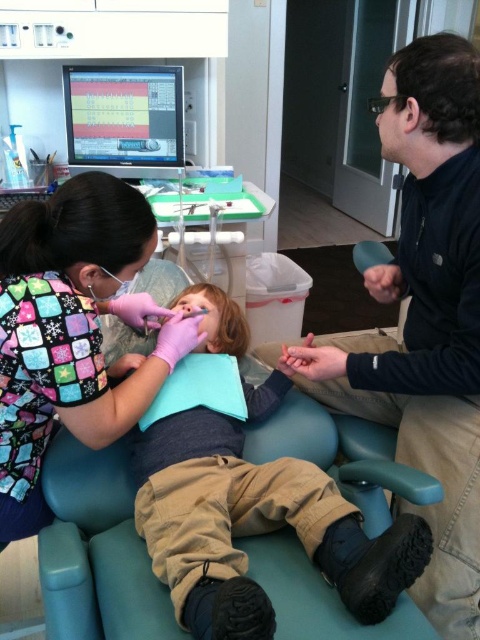
Based on the photo, you are a dental assistant in the clinic. You need to adjust the matte blue pillow at center so it aligns with the matte plastic monitor at upper center. Is the pillow currently positioned in front of or behind the monitor?

The matte blue pillow at center is closer to the viewer than the matte plastic monitor at upper center, so it is positioned in front of the monitor.